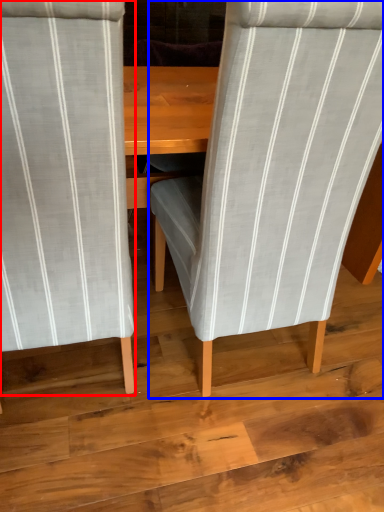
Question: Which object is closer to the camera taking this photo, chair (highlighted by a red box) or chair (highlighted by a blue box)?

Choices:
 (A) chair
 (B) chair

Answer: (A)